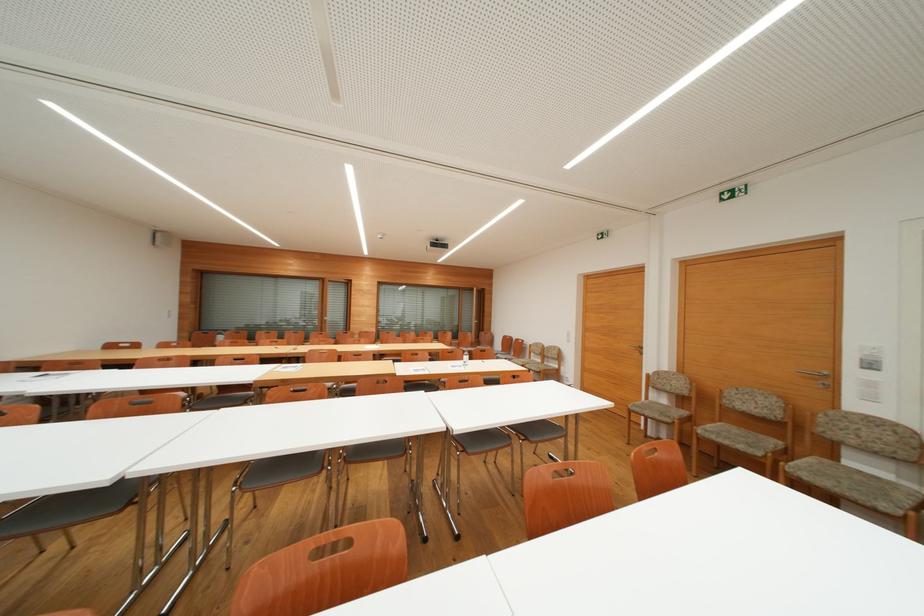
Find where to push the white light switch. Please return your answer as a coordinate pair (x, y).

(168, 313)